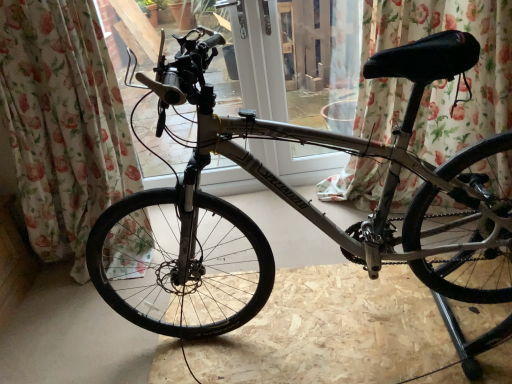
Question: Should I look upward or downward to see silver metallic bicycle at center?

Choices:
 (A) up
 (B) down

Answer: (B)

Question: Is floral fabric curtain at upper center, the 2th curtain in the left-to-right sequence, thinner than floral fabric curtain at left, positioned as the second curtain in right-to-left order?

Choices:
 (A) yes
 (B) no

Answer: (A)

Question: Considering the relative sizes of floral fabric curtain at upper center, the 2th curtain in the left-to-right sequence, and floral fabric curtain at left, the first curtain viewed from the left, in the image provided, is floral fabric curtain at upper center, the 2th curtain in the left-to-right sequence, wider than floral fabric curtain at left, the first curtain viewed from the left,?

Choices:
 (A) no
 (B) yes

Answer: (A)

Question: From the image's perspective, is floral fabric curtain at upper center, the 2th curtain in the left-to-right sequence, located above floral fabric curtain at left, the first curtain viewed from the left?

Choices:
 (A) yes
 (B) no

Answer: (A)

Question: From a real-world perspective, does floral fabric curtain at upper center, the 2th curtain in the left-to-right sequence, sit lower than floral fabric curtain at left, positioned as the second curtain in right-to-left order?

Choices:
 (A) no
 (B) yes

Answer: (B)

Question: From the image's perspective, is floral fabric curtain at upper center, which appears as the 1th curtain when viewed from the right, located beneath floral fabric curtain at left, positioned as the second curtain in right-to-left order?

Choices:
 (A) yes
 (B) no

Answer: (B)

Question: Does floral fabric curtain at upper center, which appears as the 1th curtain when viewed from the right, have a lesser height compared to floral fabric curtain at left, the first curtain viewed from the left?

Choices:
 (A) no
 (B) yes

Answer: (B)

Question: Is silver metallic bicycle at center closer to camera compared to floral fabric curtain at left, positioned as the second curtain in right-to-left order?

Choices:
 (A) yes
 (B) no

Answer: (A)

Question: Can you see silver metallic bicycle at center touching floral fabric curtain at left, the first curtain viewed from the left?

Choices:
 (A) yes
 (B) no

Answer: (B)

Question: Is silver metallic bicycle at center taller than floral fabric curtain at left, positioned as the second curtain in right-to-left order?

Choices:
 (A) yes
 (B) no

Answer: (B)

Question: Considering the relative positions of silver metallic bicycle at center and floral fabric curtain at left, the first curtain viewed from the left, in the image provided, is silver metallic bicycle at center to the right of floral fabric curtain at left, the first curtain viewed from the left, from the viewer's perspective?

Choices:
 (A) yes
 (B) no

Answer: (A)

Question: From the image's perspective, does silver metallic bicycle at center appear lower than floral fabric curtain at left, the first curtain viewed from the left?

Choices:
 (A) yes
 (B) no

Answer: (A)

Question: Is silver metallic bicycle at center not inside floral fabric curtain at left, positioned as the second curtain in right-to-left order?

Choices:
 (A) yes
 (B) no

Answer: (A)

Question: Considering the relative sizes of floral fabric curtain at left, the first curtain viewed from the left, and floral fabric curtain at upper center, which appears as the 1th curtain when viewed from the right, in the image provided, is floral fabric curtain at left, the first curtain viewed from the left, wider than floral fabric curtain at upper center, which appears as the 1th curtain when viewed from the right,?

Choices:
 (A) yes
 (B) no

Answer: (A)